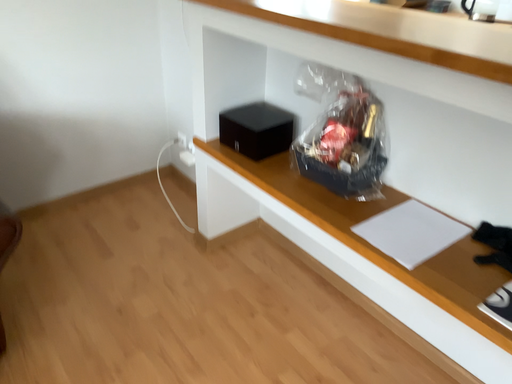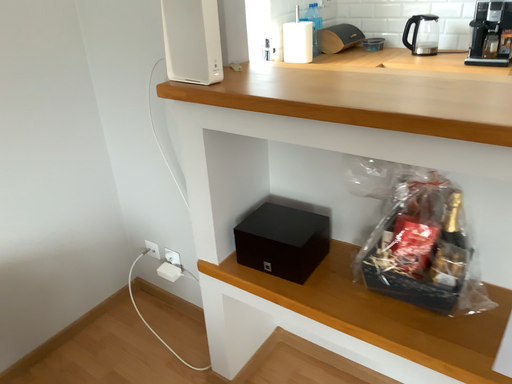
Question: How did the camera likely rotate when shooting the video?

Choices:
 (A) rotated right
 (B) rotated left

Answer: (A)